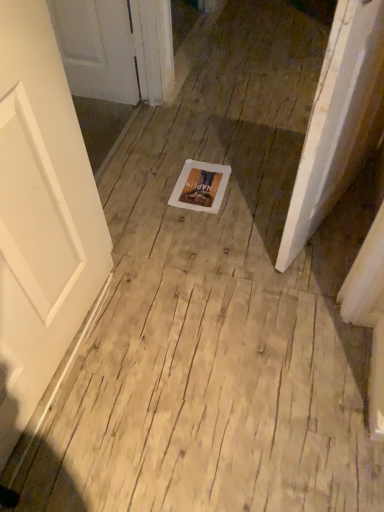
Question: Considering the relative positions of white paper at center and light brown wood floor at center in the image provided, is white paper at center in front of light brown wood floor at center?

Choices:
 (A) no
 (B) yes

Answer: (A)

Question: From a real-world perspective, is white paper at center over light brown wood floor at center?

Choices:
 (A) no
 (B) yes

Answer: (B)

Question: Are white paper at center and light brown wood floor at center beside each other?

Choices:
 (A) yes
 (B) no

Answer: (B)

Question: Can you confirm if white paper at center is smaller than light brown wood floor at center?

Choices:
 (A) no
 (B) yes

Answer: (B)

Question: Does white paper at center have a greater width compared to light brown wood floor at center?

Choices:
 (A) no
 (B) yes

Answer: (A)

Question: Could you tell me if white paper at center is turned towards light brown wood floor at center?

Choices:
 (A) yes
 (B) no

Answer: (A)

Question: Is light brown wood floor at center wider than white paper at center?

Choices:
 (A) yes
 (B) no

Answer: (A)

Question: Considering the relative sizes of light brown wood floor at center and white paper at center in the image provided, is light brown wood floor at center bigger than white paper at center?

Choices:
 (A) yes
 (B) no

Answer: (A)

Question: From a real-world perspective, is light brown wood floor at center located beneath white paper at center?

Choices:
 (A) no
 (B) yes

Answer: (B)

Question: Considering the relative sizes of light brown wood floor at center and white paper at center in the image provided, is light brown wood floor at center smaller than white paper at center?

Choices:
 (A) no
 (B) yes

Answer: (A)

Question: Is light brown wood floor at center at the left side of white paper at center?

Choices:
 (A) no
 (B) yes

Answer: (A)

Question: Is light brown wood floor at center not within white paper at center?

Choices:
 (A) no
 (B) yes

Answer: (B)

Question: From the image's perspective, is light brown wood floor at center positioned above or below white paper at center?

Choices:
 (A) above
 (B) below

Answer: (B)